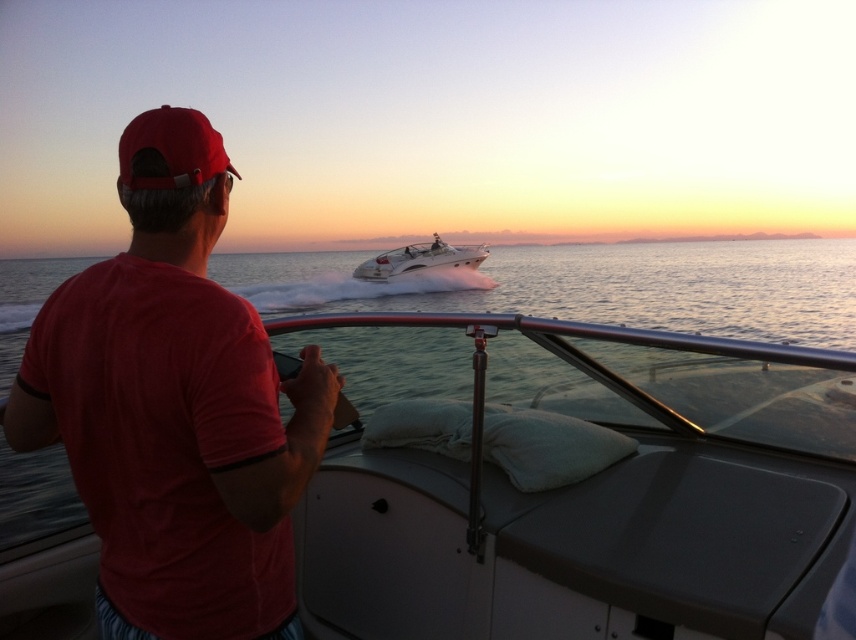
You are on a boat watching the sunset and see two points in the sky, point 1 at coordinates point (159, 307) and point 2 at coordinates point (403, 253). Which point is closer to you?

Point (159, 307) is closer to the viewer than point (403, 253).